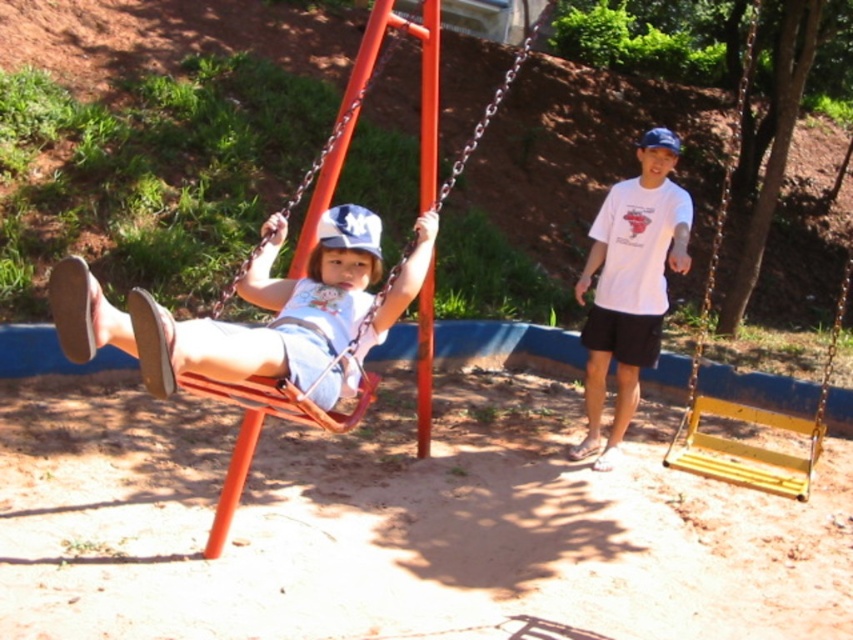
Question: Which of the following is the closest to the observer?

Choices:
 (A) (225, 362)
 (B) (310, 170)
 (C) (828, 372)
 (D) (614, 321)

Answer: (A)

Question: Which of the following is the closest to the observer?

Choices:
 (A) (688, 435)
 (B) (329, 161)

Answer: (B)

Question: Which object is closer to the camera taking this photo?

Choices:
 (A) matte plastic swing at center
 (B) white cotton t-shirt at center
 (C) yellow/yellowish plastic swing at right
 (D) matte white shorts at center

Answer: (D)

Question: Is white cotton t-shirt at center closer to the viewer compared to matte plastic swing at center?

Choices:
 (A) no
 (B) yes

Answer: (A)

Question: Is yellow/yellowish plastic swing at right to the left of matte plastic swing at center from the viewer's perspective?

Choices:
 (A) yes
 (B) no

Answer: (B)

Question: Is white cotton t-shirt at center smaller than matte plastic swing at center?

Choices:
 (A) no
 (B) yes

Answer: (B)